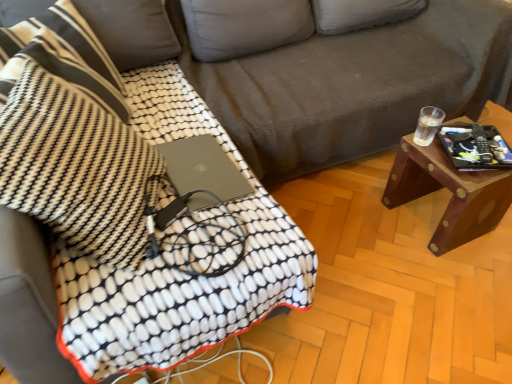
At what (x,y) coordinates should I click in order to perform the action: click on free spot above white textured blanket at center (from a real-world perspective). Please return your answer as a coordinate pair (x, y). Looking at the image, I should click on [x=170, y=173].